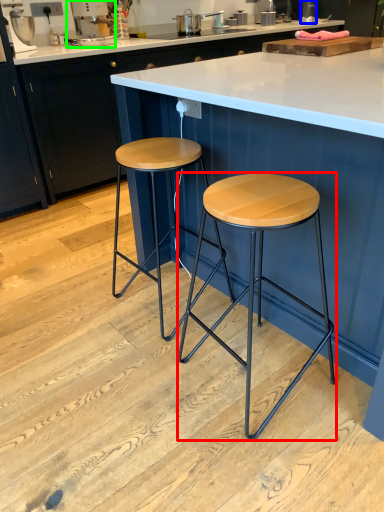
Question: Based on their relative distances, which object is nearer to stool (highlighted by a red box)? Choose from appliance (highlighted by a blue box) and appliance (highlighted by a green box).

Choices:
 (A) appliance
 (B) appliance

Answer: (B)